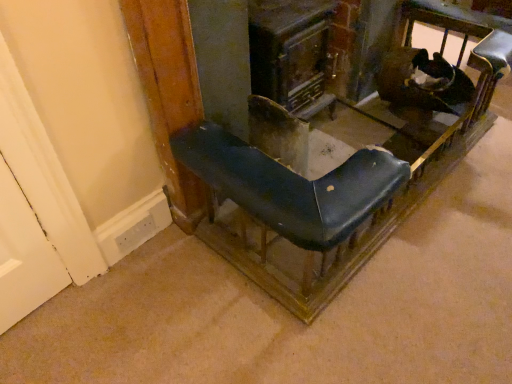
What do you see at coordinates (325, 165) in the screenshot?
I see `leather-like dark blue chair at center` at bounding box center [325, 165].

Image resolution: width=512 pixels, height=384 pixels. Identify the location of leather-like dark blue chair at center. (325, 165).

Measure the distance between point (198, 227) and camera.

The distance of point (198, 227) from camera is 1.55 meters.

Image resolution: width=512 pixels, height=384 pixels. Identify the location of leather-like dark blue chair at center. (325, 165).